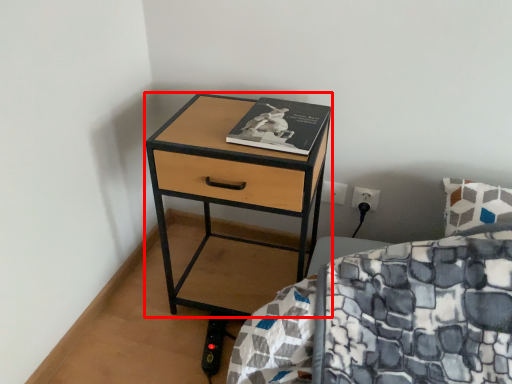
Question: From the image's perspective, where is nightstand (annotated by the red box) located relative to book?

Choices:
 (A) above
 (B) below

Answer: (B)